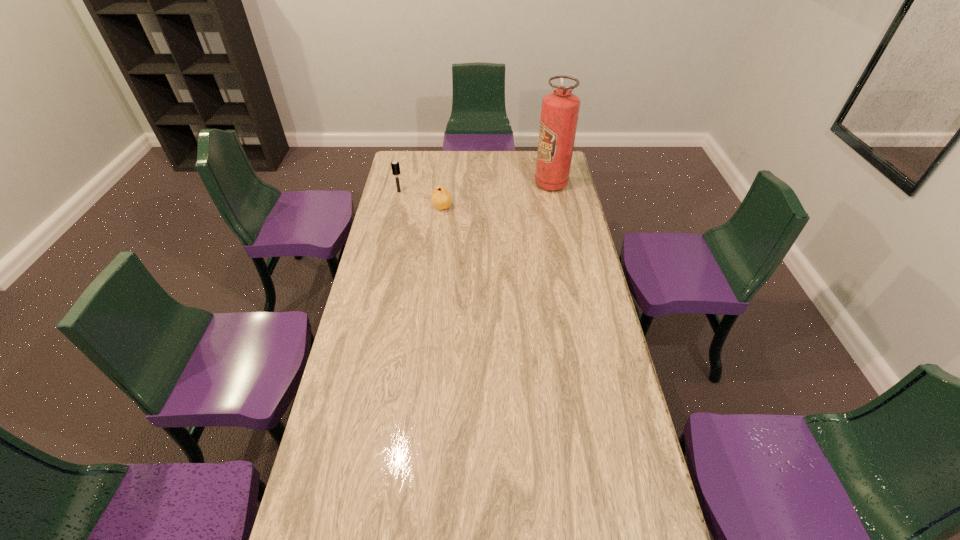
The height and width of the screenshot is (540, 960). What are the coordinates of `free region located 0.290m on the front of the shortest object` in the screenshot? It's located at (437, 256).

At what (x,y) coordinates should I click in order to perform the action: click on object positioned at the far edge. Please return your answer as a coordinate pair (x, y). This screenshot has height=540, width=960. Looking at the image, I should click on (560, 109).

Where is `object that is at the left edge`? This screenshot has width=960, height=540. object that is at the left edge is located at coordinates (395, 165).

Identify the location of object that is at the right edge. This screenshot has width=960, height=540. (560, 109).

Identify the location of object that is at the far right corner. (560, 109).

In the image, there is a desktop. Find the location of `vacant area at the far edge`. vacant area at the far edge is located at coordinates (506, 158).

You are a GUI agent. You are given a task and a screenshot of the screen. Output one action in this format:
    pyautogui.click(x=<x>, y=<y>)
    Task: Click on the vacant space at the left edge of the desktop
    The width and height of the screenshot is (960, 540).
    Given the screenshot: What is the action you would take?
    (x=316, y=527)

Locate an element on the screen. vacant area at the right edge of the desktop is located at coordinates (584, 253).

Find the location of a particular element. This screenshot has height=540, width=960. vacant area between the second shortest object and the rightmost object is located at coordinates (475, 187).

Where is `vacant area that lies between the fire extinguisher and the nearest object`? This screenshot has height=540, width=960. vacant area that lies between the fire extinguisher and the nearest object is located at coordinates (496, 195).